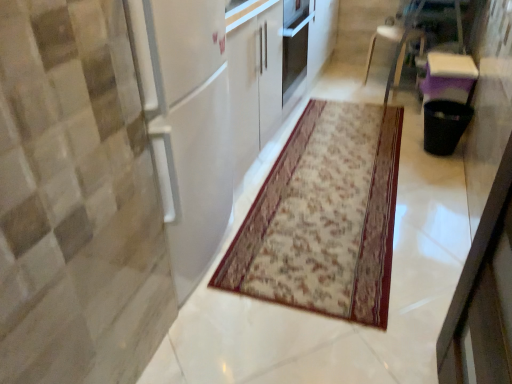
Question: Is point (392, 155) closer or farther from the camera than point (374, 34)?

Choices:
 (A) farther
 (B) closer

Answer: (B)

Question: Is patterned carpet at center in front of or behind white plastic chair at upper right in the image?

Choices:
 (A) front
 (B) behind

Answer: (A)

Question: From the image's perspective, is patterned carpet at center above or below white plastic chair at upper right?

Choices:
 (A) below
 (B) above

Answer: (A)

Question: Considering their positions, is white plastic chair at upper right located in front of or behind patterned carpet at center?

Choices:
 (A) front
 (B) behind

Answer: (B)

Question: Looking at the image, does white plastic chair at upper right seem bigger or smaller compared to patterned carpet at center?

Choices:
 (A) small
 (B) big

Answer: (B)

Question: Does point (372, 49) appear closer or farther from the camera than point (315, 296)?

Choices:
 (A) closer
 (B) farther

Answer: (B)

Question: In terms of height, does white plastic chair at upper right look taller or shorter compared to patterned carpet at center?

Choices:
 (A) tall
 (B) short

Answer: (A)